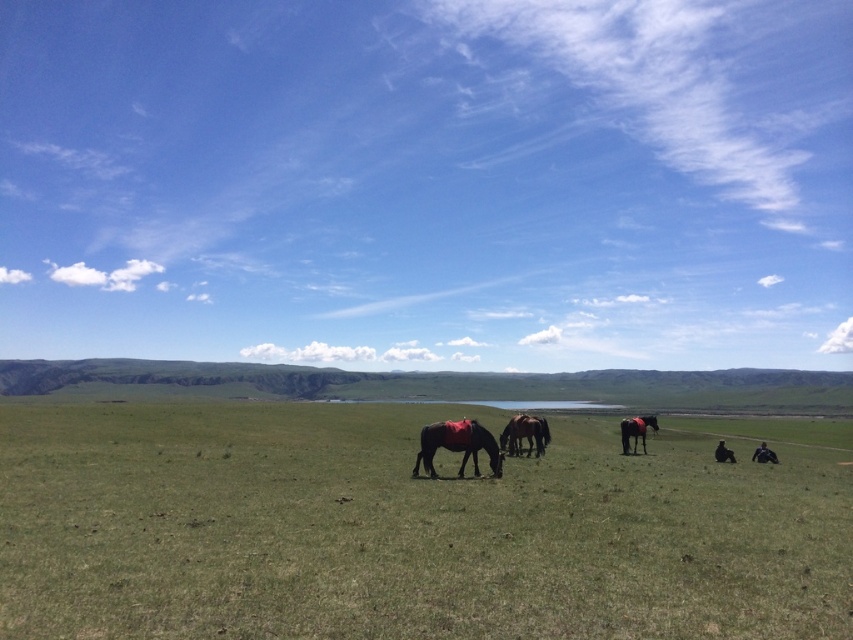
Is green grass pasture at center thinner than shiny brown horse at lower right?

In fact, green grass pasture at center might be wider than shiny brown horse at lower right.

Does green grass pasture at center come in front of shiny brown horse at lower right?

That is True.

Measure the distance between green grass pasture at center and camera.

They are 5.69 meters apart.

Locate an element on the screen. This screenshot has width=853, height=640. green grass pasture at center is located at coordinates 409,529.

Can you confirm if green grass pasture at center is shorter than dark brown glossy horse at center?

Incorrect, green grass pasture at center's height does not fall short of dark brown glossy horse at center's.

Can you confirm if green grass pasture at center is positioned to the left of dark brown glossy horse at center?

Indeed, green grass pasture at center is positioned on the left side of dark brown glossy horse at center.

Where is `green grass pasture at center`? This screenshot has height=640, width=853. green grass pasture at center is located at coordinates (409, 529).

Where is `green grass pasture at center`? The width and height of the screenshot is (853, 640). green grass pasture at center is located at coordinates (409, 529).

Does shiny black horse at center have a lesser width compared to shiny brown horse at lower right?

Indeed, shiny black horse at center has a lesser width compared to shiny brown horse at lower right.

Can you confirm if shiny black horse at center is positioned below shiny brown horse at lower right?

No.

The width and height of the screenshot is (853, 640). Identify the location of shiny black horse at center. (457, 445).